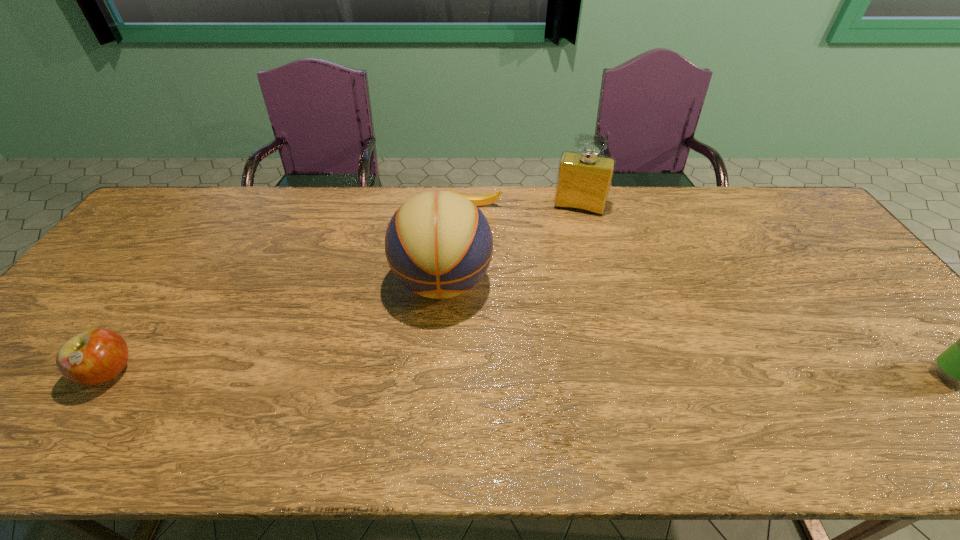
This screenshot has width=960, height=540. Find the location of `vacant space on the desktop that is between the apple and the rightmost object and is positioned on the patterned surface of the basketball`. vacant space on the desktop that is between the apple and the rightmost object and is positioned on the patterned surface of the basketball is located at coordinates pos(441,374).

You are a GUI agent. You are given a task and a screenshot of the screen. Output one action in this format:
    pyautogui.click(x=<x>, y=<y>)
    Task: Click on the vacant spot on the desktop that is between the second shortest object and the rightmost object and is positioned at the stem of the shortest object
    The image size is (960, 540).
    Given the screenshot: What is the action you would take?
    pyautogui.click(x=493, y=375)

At what (x,y) coordinates should I click in order to perform the action: click on vacant space on the desktop that is between the apple and the water bottle and is positioned on the front-facing side of the perfume. Please return your answer as a coordinate pair (x, y). The width and height of the screenshot is (960, 540). Looking at the image, I should click on point(539,375).